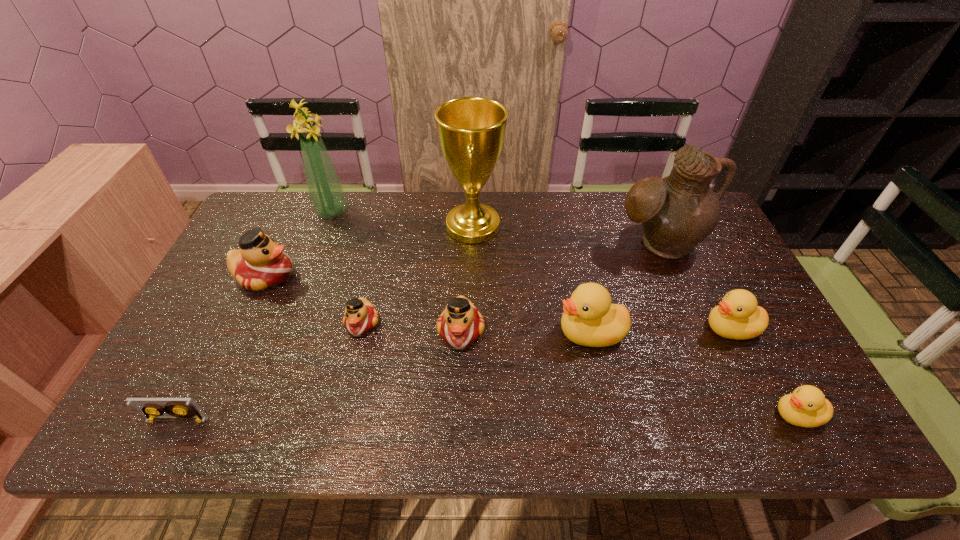
Identify the location of object at the near left corner. The height and width of the screenshot is (540, 960). (176, 409).

The width and height of the screenshot is (960, 540). I want to click on object that is at the far right corner, so click(x=677, y=212).

Locate an element on the screen. This screenshot has height=540, width=960. object that is at the near right corner is located at coordinates (807, 406).

You are a GUI agent. You are given a task and a screenshot of the screen. Output one action in this format:
    pyautogui.click(x=<x>, y=<y>)
    Task: Click on the free space at the far edge of the desktop
    The width and height of the screenshot is (960, 540).
    Given the screenshot: What is the action you would take?
    point(537,196)

This screenshot has width=960, height=540. In order to click on vacant space at the near edge of the desktop in this screenshot , I will do `click(382, 407)`.

This screenshot has width=960, height=540. What are the coordinates of `blank area at the left edge` in the screenshot? It's located at (276, 240).

In the image, there is a desktop. Find the location of `vacant area at the right edge`. vacant area at the right edge is located at coordinates pos(720,250).

Image resolution: width=960 pixels, height=540 pixels. What are the coordinates of `blank space at the far left corner` in the screenshot? It's located at (267, 204).

Where is `free space between the second biggest yellow duck and the third tallest object`? free space between the second biggest yellow duck and the third tallest object is located at coordinates click(x=695, y=286).

Locate an element on the screen. The width and height of the screenshot is (960, 540). vacant region between the second smallest yellow duck and the green bouquet is located at coordinates (531, 270).